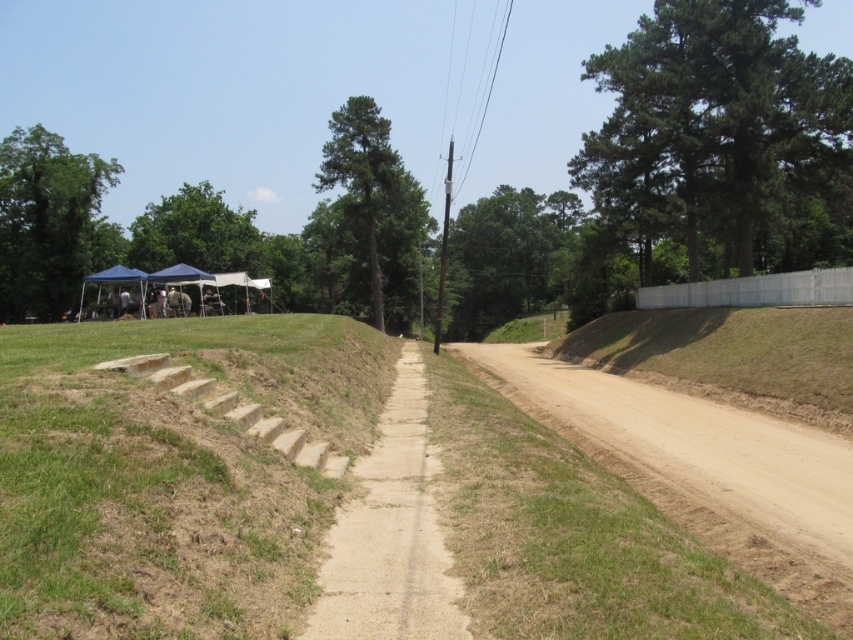
Question: Which object appears closest to the camera in this image?

Choices:
 (A) green leafy tree at upper right
 (B) green leafy tree at upper left
 (C) dirt/gravel path at center
 (D) green grass at lower left

Answer: (D)

Question: Does green grass at lower left have a lesser width compared to dirt/gravel path at center?

Choices:
 (A) no
 (B) yes

Answer: (A)

Question: Among these objects, which one is nearest to the camera?

Choices:
 (A) green leafy tree at upper right
 (B) green matte tree at center
 (C) green grass at lower left
 (D) green leafy tree at upper left

Answer: (C)

Question: Which point appears farthest from the camera in this image?

Choices:
 (A) (341, 392)
 (B) (12, 177)

Answer: (B)

Question: Can you confirm if green leafy tree at upper right is positioned to the left of dirt/gravel path at center?

Choices:
 (A) no
 (B) yes

Answer: (A)

Question: Is green grass at lower left smaller than green leafy tree at upper right?

Choices:
 (A) no
 (B) yes

Answer: (B)